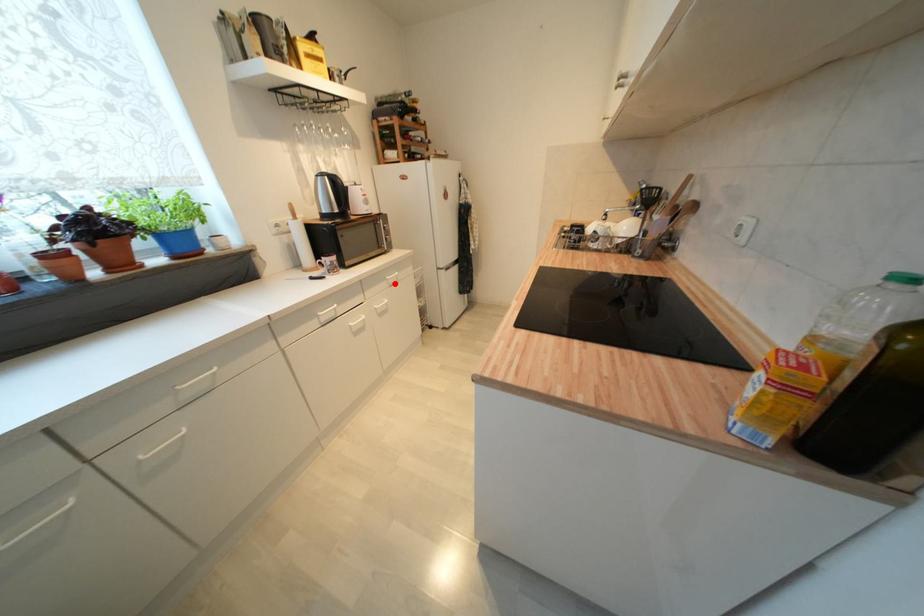
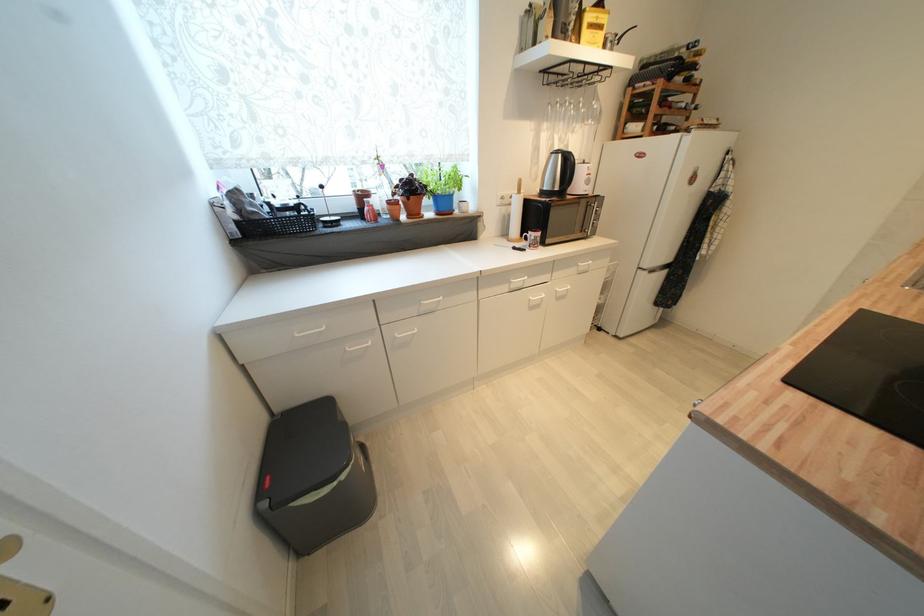
Question: A red point is marked in image1. In image2, is the corresponding 3D point closer to the camera or farther? Reply with the corresponding letter.

Choices:
 (A) The corresponding 3D point is closer.
 (B) The corresponding 3D point is farther.

Answer: (B)